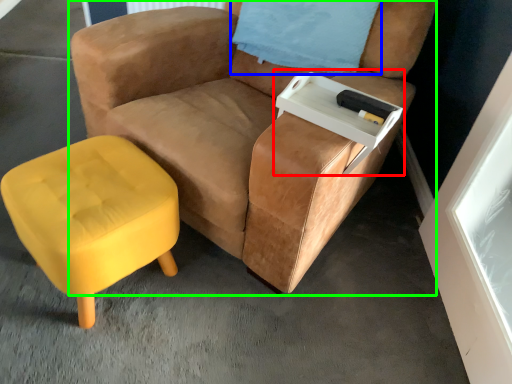
Question: Estimate the real-world distances between objects in this image. Which object is farther from side table (highlighted by a red box), pillow (highlighted by a blue box) or chair (highlighted by a green box)?

Choices:
 (A) pillow
 (B) chair

Answer: (A)